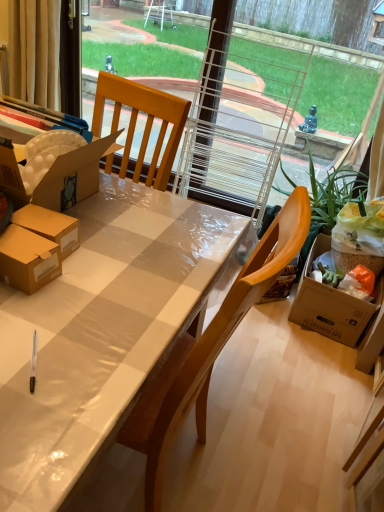
Question: Can you confirm if matte plastic desk at center is positioned to the left of green leafy plant at right?

Choices:
 (A) no
 (B) yes

Answer: (B)

Question: Is matte plastic desk at center looking in the opposite direction of green leafy plant at right?

Choices:
 (A) no
 (B) yes

Answer: (A)

Question: Considering the relative sizes of matte plastic desk at center and green leafy plant at right in the image provided, is matte plastic desk at center taller than green leafy plant at right?

Choices:
 (A) no
 (B) yes

Answer: (A)

Question: Is matte plastic desk at center not inside green leafy plant at right?

Choices:
 (A) no
 (B) yes

Answer: (B)

Question: Is the position of matte plastic desk at center less distant than that of green leafy plant at right?

Choices:
 (A) yes
 (B) no

Answer: (A)

Question: From the image's perspective, is beige fabric curtain at upper left positioned above or below matte plastic desk at center?

Choices:
 (A) below
 (B) above

Answer: (B)

Question: Looking at their shapes, would you say beige fabric curtain at upper left is wider or thinner than matte plastic desk at center?

Choices:
 (A) wide
 (B) thin

Answer: (B)

Question: In terms of height, does beige fabric curtain at upper left look taller or shorter compared to matte plastic desk at center?

Choices:
 (A) tall
 (B) short

Answer: (B)

Question: Considering their positions, is beige fabric curtain at upper left located in front of or behind matte plastic desk at center?

Choices:
 (A) behind
 (B) front

Answer: (A)

Question: From the image's perspective, is green leafy plant at right positioned above or below matte plastic desk at center?

Choices:
 (A) above
 (B) below

Answer: (A)

Question: In the image, is green leafy plant at right positioned in front of or behind matte plastic desk at center?

Choices:
 (A) front
 (B) behind

Answer: (B)

Question: From a real-world perspective, is green leafy plant at right positioned above or below matte plastic desk at center?

Choices:
 (A) below
 (B) above

Answer: (B)

Question: Considering the positions of green leafy plant at right and matte plastic desk at center in the image, is green leafy plant at right bigger or smaller than matte plastic desk at center?

Choices:
 (A) small
 (B) big

Answer: (A)

Question: From a real-world perspective, is matte plastic desk at center positioned above or below green leafy plant at right?

Choices:
 (A) below
 (B) above

Answer: (A)

Question: Looking at their shapes, would you say matte plastic desk at center is wider or thinner than green leafy plant at right?

Choices:
 (A) thin
 (B) wide

Answer: (B)